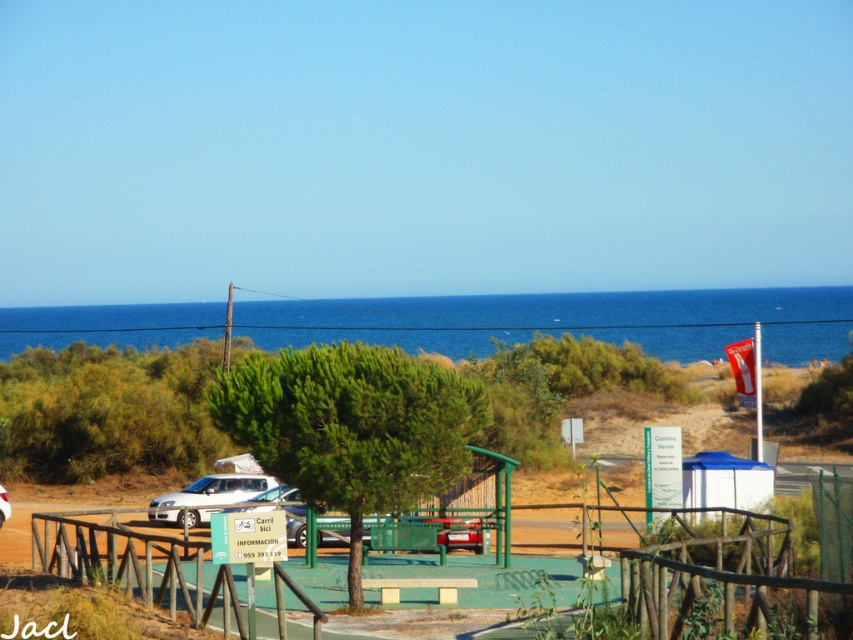
You are a visitor at the coastal park and want to park your car near the bench. There are two white matte cars already parked. Which car is closer to the bench? The white matte car at lower left or the white matte car at center?

The white matte car at lower left is positioned on the right side of white matte car at center, so the white matte car at center is closer to the bench.